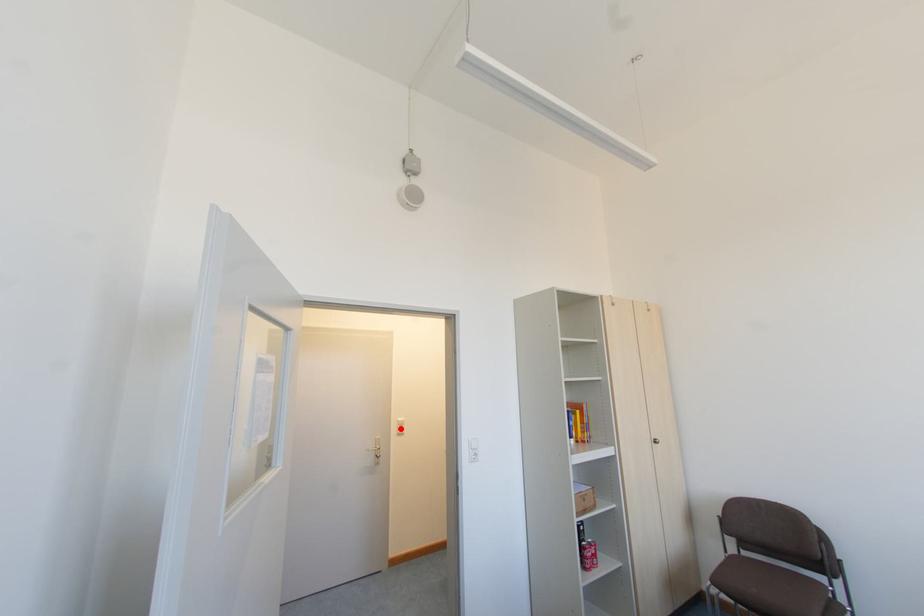
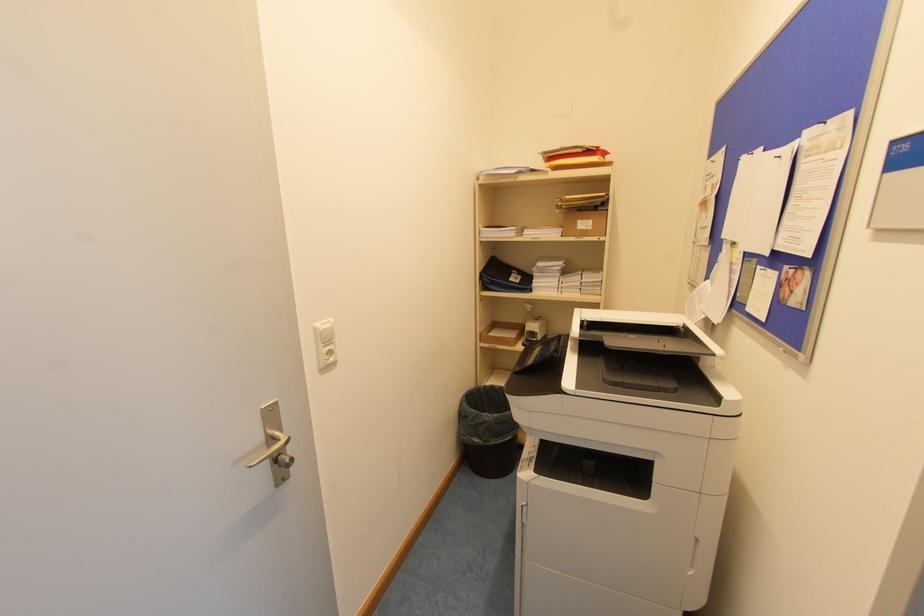
Find the pixel in the second image that matches the highlighted location in the first image.

(330, 352)